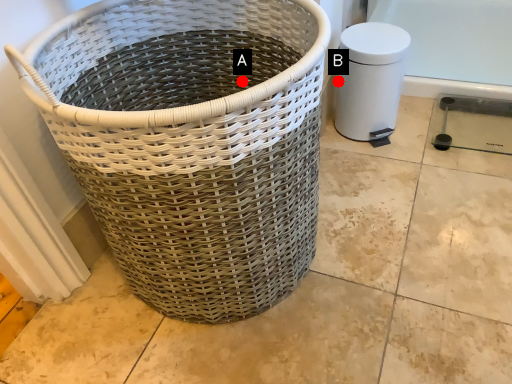
Question: Two points are circled on the image, labeled by A and B beside each circle. Which of the following is the farthest from the observer?

Choices:
 (A) A is further
 (B) B is further

Answer: (B)